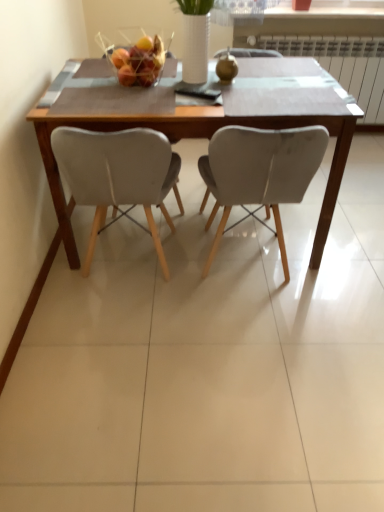
Identify the location of blank space situated above wooden table at center (from a real-world perspective). The width and height of the screenshot is (384, 512). (224, 86).